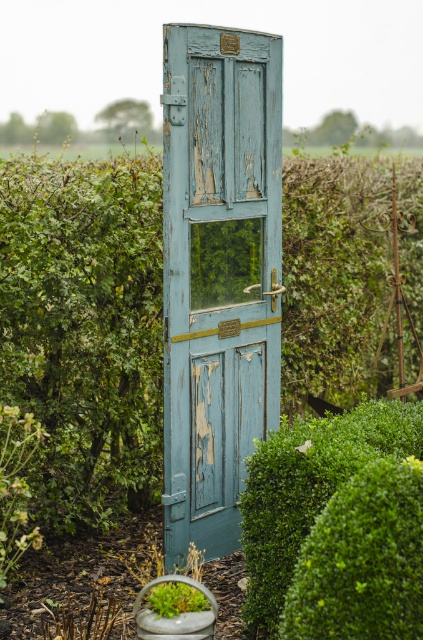
Is point (44, 444) behind point (258, 548)?

That is True.

Based on the photo, does green leafy bush at center have a greater height compared to green leafy bush at right?

Yes.

Consider the image. Measure the distance between point (110, 371) and camera.

Point (110, 371) is 4.72 meters away from camera.

At what (x,y) coordinates should I click in order to perform the action: click on green leafy bush at center. Please return your answer as a coordinate pair (x, y). The image size is (423, 640). Looking at the image, I should click on (84, 330).

Can you confirm if blue peeling paint door at center is bigger than green leafy bush at right?

Yes.

Describe the element at coordinates (217, 273) in the screenshot. I see `blue peeling paint door at center` at that location.

Measure the distance between point (219, 380) and camera.

Point (219, 380) is 14.78 feet from camera.

The height and width of the screenshot is (640, 423). In order to click on blue peeling paint door at center in this screenshot , I will do `click(217, 273)`.

Is blue peeling paint door at center thinner than green leafy bush at center?

Correct, blue peeling paint door at center's width is less than green leafy bush at center's.

Can you confirm if blue peeling paint door at center is bigger than green leafy bush at center?

Incorrect, blue peeling paint door at center is not larger than green leafy bush at center.

Is point (258, 122) behind point (30, 484)?

Yes, it is.

Find the location of a particular element. The height and width of the screenshot is (640, 423). blue peeling paint door at center is located at coordinates (217, 273).